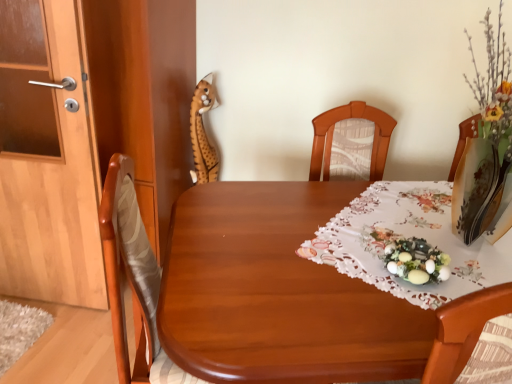
Question: Is the depth of white lace tablecloth at center greater than that of wooden door at left?

Choices:
 (A) yes
 (B) no

Answer: (B)

Question: From a real-world perspective, is white lace tablecloth at center positioned under wooden door at left based on gravity?

Choices:
 (A) yes
 (B) no

Answer: (A)

Question: Considering the relative sizes of white lace tablecloth at center and wooden door at left in the image provided, is white lace tablecloth at center wider than wooden door at left?

Choices:
 (A) no
 (B) yes

Answer: (B)

Question: Can you confirm if white lace tablecloth at center is bigger than wooden door at left?

Choices:
 (A) yes
 (B) no

Answer: (A)

Question: Is white lace tablecloth at center oriented away from wooden door at left?

Choices:
 (A) no
 (B) yes

Answer: (A)

Question: Considering the positions of white lace tablecloth at center and spotted plush giraffe at upper left in the image, is white lace tablecloth at center taller or shorter than spotted plush giraffe at upper left?

Choices:
 (A) tall
 (B) short

Answer: (A)

Question: From a real-world perspective, is white lace tablecloth at center physically located above or below spotted plush giraffe at upper left?

Choices:
 (A) above
 (B) below

Answer: (B)

Question: In the image, is white lace tablecloth at center positioned in front of or behind spotted plush giraffe at upper left?

Choices:
 (A) behind
 (B) front

Answer: (B)

Question: Would you say white lace tablecloth at center is to the left or to the right of spotted plush giraffe at upper left in the picture?

Choices:
 (A) left
 (B) right

Answer: (B)

Question: From a real-world perspective, relative to wooden table at center, is white lace tablecloth at center vertically above or below?

Choices:
 (A) above
 (B) below

Answer: (B)

Question: Based on their sizes in the image, would you say white lace tablecloth at center is bigger or smaller than wooden table at center?

Choices:
 (A) small
 (B) big

Answer: (B)

Question: Is white lace tablecloth at center inside the boundaries of wooden table at center, or outside?

Choices:
 (A) outside
 (B) inside

Answer: (A)

Question: From the image's perspective, is white lace tablecloth at center positioned above or below wooden table at center?

Choices:
 (A) above
 (B) below

Answer: (B)

Question: Looking at the image, does spotted plush giraffe at upper left seem bigger or smaller compared to wooden table at center?

Choices:
 (A) small
 (B) big

Answer: (A)

Question: In terms of height, does spotted plush giraffe at upper left look taller or shorter compared to wooden table at center?

Choices:
 (A) short
 (B) tall

Answer: (B)